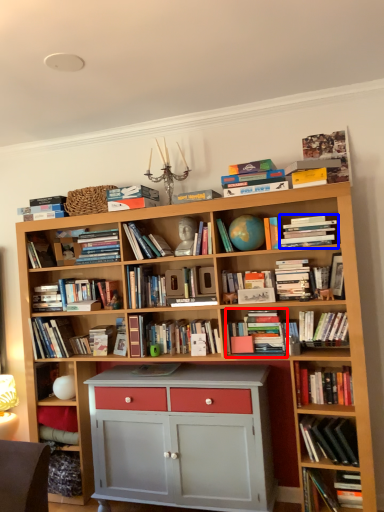
Question: Among these objects, which one is farthest to the camera, book (highlighted by a red box) or book (highlighted by a blue box)?

Choices:
 (A) book
 (B) book

Answer: (A)